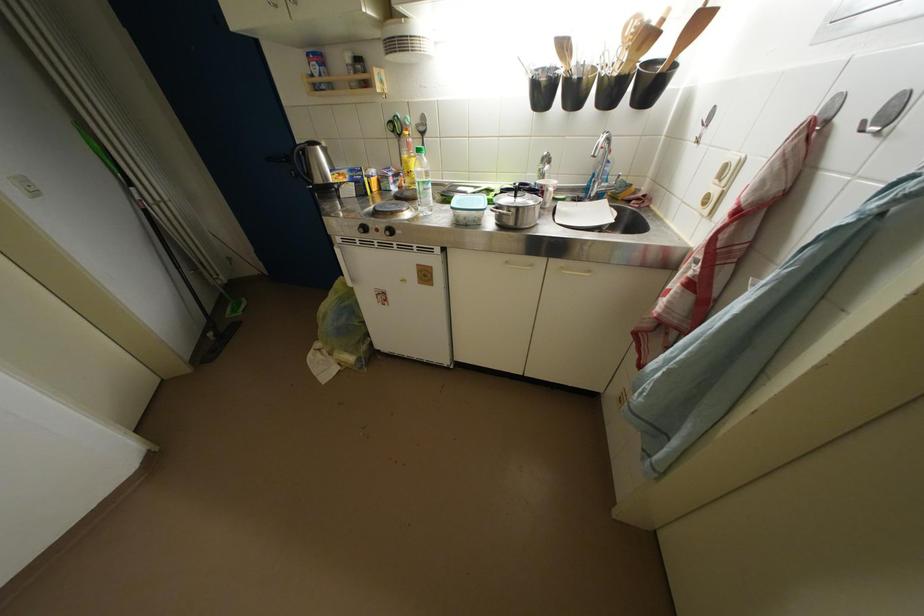
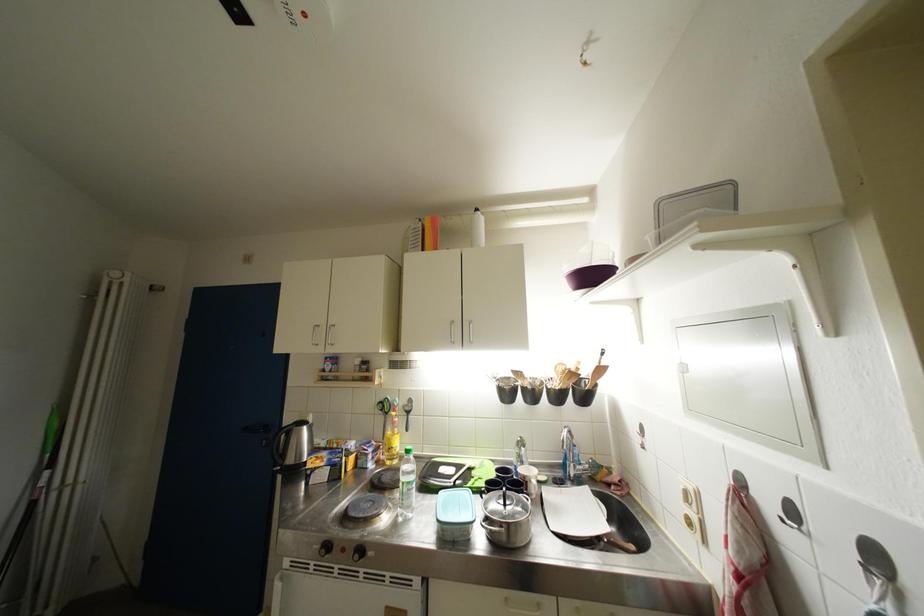
Question: The images are taken continuously from a first-person perspective. In which direction is your viewpoint rotating?

Choices:
 (A) Left
 (B) Right
 (C) Up
 (D) Down

Answer: (C)